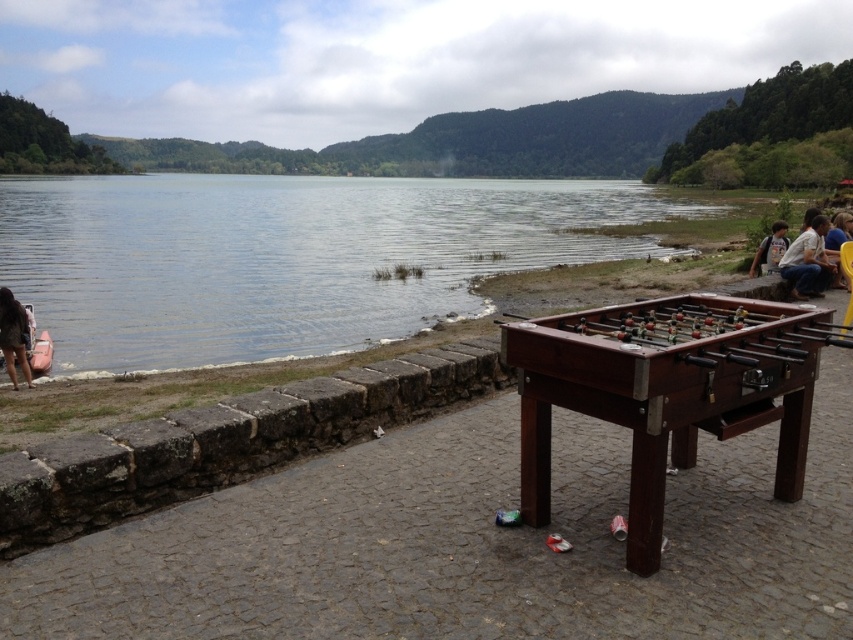
Question: Does clear water at lake left appear on the right side of wooden foosball table at center?

Choices:
 (A) yes
 (B) no

Answer: (B)

Question: Can you confirm if wooden foosball table at center is thinner than yellow plastic chair at right?

Choices:
 (A) no
 (B) yes

Answer: (A)

Question: Which of the following is the farthest from the observer?

Choices:
 (A) (641, 209)
 (B) (650, 305)
 (C) (780, 240)
 (D) (824, 273)

Answer: (A)

Question: Which point is farther to the camera?

Choices:
 (A) (525, 515)
 (B) (109, 193)
 (C) (769, 234)
 (D) (25, 317)

Answer: (B)

Question: Considering the real-world distances, which object is closest to the yellow plastic chair at right?

Choices:
 (A) white cotton shirt at right
 (B) clear water at lake left
 (C) light blue denim jacket at lower right
 (D) wooden foosball table at center

Answer: (C)

Question: In this image, where is clear water at lake left located relative to wooden foosball table at center?

Choices:
 (A) left
 (B) right

Answer: (A)